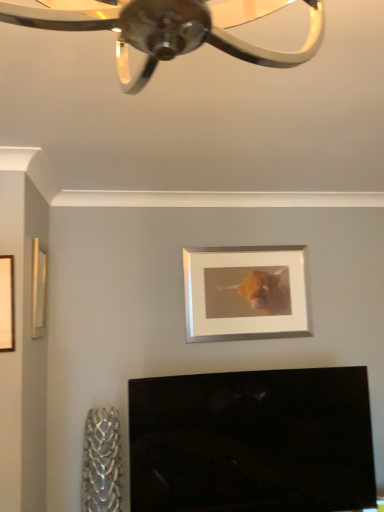
This screenshot has width=384, height=512. What do you see at coordinates (246, 293) in the screenshot?
I see `white matte picture frame at upper center, the first picture frame from the right` at bounding box center [246, 293].

You are a GUI agent. You are given a task and a screenshot of the screen. Output one action in this format:
    pyautogui.click(x=<x>, y=<y>)
    Task: Click on the wooden frame at left, arranged as the 3th picture frame when viewed from the right
    Image resolution: width=384 pixels, height=512 pixels.
    Given the screenshot: What is the action you would take?
    pyautogui.click(x=7, y=304)

What do you see at coordinates (38, 289) in the screenshot? I see `wooden frame at left, the 2th picture frame positioned from the front` at bounding box center [38, 289].

Locate an element on the screen. white matte picture frame at upper center, placed as the 3th picture frame when sorted from left to right is located at coordinates (246, 293).

In the image, there is a wooden frame at left, placed as the 3th picture frame when sorted from back to front. Identify the location of picture frame below it (from the image's perspective). This screenshot has height=512, width=384. (246, 293).

From a real-world perspective, who is located higher, white matte picture frame at upper center, which is the 1th picture frame from back to front, or wooden frame at left, arranged as the 3th picture frame when viewed from the right?

white matte picture frame at upper center, which is the 1th picture frame from back to front.

Is white matte picture frame at upper center, placed as the 3th picture frame when sorted from left to right, inside the boundaries of wooden frame at left, marked as the 1th picture frame in a front-to-back arrangement, or outside?

white matte picture frame at upper center, placed as the 3th picture frame when sorted from left to right, is not inside wooden frame at left, marked as the 1th picture frame in a front-to-back arrangement, it's outside.

Considering the sizes of objects white matte picture frame at upper center, the first picture frame from the right, and wooden frame at left, placed as the 3th picture frame when sorted from back to front, in the image provided, who is thinner, white matte picture frame at upper center, the first picture frame from the right, or wooden frame at left, placed as the 3th picture frame when sorted from back to front,?

Thinner between the two is wooden frame at left, placed as the 3th picture frame when sorted from back to front.

Does point (32, 319) lie in front of point (299, 298)?

Yes, it is in front of point (299, 298).

In the image, is wooden frame at left, which is the second picture frame from right to left, positioned in front of or behind white matte picture frame at upper center, acting as the 3th picture frame starting from the front?

Visually, wooden frame at left, which is the second picture frame from right to left, is located in front of white matte picture frame at upper center, acting as the 3th picture frame starting from the front.

Consider the image. Is there a large distance between wooden frame at left, the second picture frame viewed from the back, and white matte picture frame at upper center, placed as the 3th picture frame when sorted from left to right?

wooden frame at left, the second picture frame viewed from the back, is positioned a significant distance from white matte picture frame at upper center, placed as the 3th picture frame when sorted from left to right.

Considering the points (1, 283) and (211, 266), which point is in front, point (1, 283) or point (211, 266)?

The point (1, 283) is in front.

Relative to white matte picture frame at upper center, placed as the 3th picture frame when sorted from left to right, is wooden frame at left, placed as the 3th picture frame when sorted from back to front, in front or behind?

In the image, wooden frame at left, placed as the 3th picture frame when sorted from back to front, appears in front of white matte picture frame at upper center, placed as the 3th picture frame when sorted from left to right.

Which object is thinner, wooden frame at left, which is counted as the 1th picture frame, starting from the left, or white matte picture frame at upper center, the first picture frame from the right?

wooden frame at left, which is counted as the 1th picture frame, starting from the left, is thinner.

Between wooden frame at left, placed as the 3th picture frame when sorted from back to front, and white matte picture frame at upper center, the first picture frame from the right, which one appears on the left side from the viewer's perspective?

wooden frame at left, placed as the 3th picture frame when sorted from back to front, is more to the left.

From a real-world perspective, is wooden frame at left, which is counted as the 1th picture frame, starting from the left, located beneath wooden frame at left, the second picture frame viewed from the back?

Yes.

Is wooden frame at left, placed as the 3th picture frame when sorted from back to front, positioned with its back to wooden frame at left, acting as the 2th picture frame starting from the left?

Yes, wooden frame at left, placed as the 3th picture frame when sorted from back to front, is positioned with its back facing wooden frame at left, acting as the 2th picture frame starting from the left.

The width and height of the screenshot is (384, 512). What are the coordinates of `picture frame that is the 2nd one below the wooden frame at left, which is the second picture frame from right to left (from a real-world perspective)` in the screenshot? It's located at (7, 304).

Measure the distance between wooden frame at left, which is counted as the 1th picture frame, starting from the left, and wooden frame at left, the second picture frame viewed from the back.

They are 10.85 inches apart.

From the image's perspective, is white matte picture frame at upper center, the first picture frame from the right, under wooden frame at left, the 2th picture frame positioned from the front?

Indeed, from the image's perspective, white matte picture frame at upper center, the first picture frame from the right, is shown beneath wooden frame at left, the 2th picture frame positioned from the front.

Does white matte picture frame at upper center, which is the 1th picture frame from back to front, touch wooden frame at left, the 2th picture frame positioned from the front?

No, white matte picture frame at upper center, which is the 1th picture frame from back to front, is not in contact with wooden frame at left, the 2th picture frame positioned from the front.

Identify the location of picture frame behind the wooden frame at left, which is the second picture frame from right to left. (246, 293).

Considering the sizes of white matte picture frame at upper center, the first picture frame from the right, and wooden frame at left, the 2th picture frame positioned from the front, in the image, is white matte picture frame at upper center, the first picture frame from the right, taller or shorter than wooden frame at left, the 2th picture frame positioned from the front,?

In the image, white matte picture frame at upper center, the first picture frame from the right, appears to be taller than wooden frame at left, the 2th picture frame positioned from the front.

The image size is (384, 512). I want to click on picture frame lying on the left of wooden frame at left, the second picture frame viewed from the back, so click(7, 304).

From a real-world perspective, does wooden frame at left, the 2th picture frame positioned from the front, sit lower than wooden frame at left, arranged as the 3th picture frame when viewed from the right?

No, from a real-world perspective, wooden frame at left, the 2th picture frame positioned from the front, is not beneath wooden frame at left, arranged as the 3th picture frame when viewed from the right.

Which is in front, point (35, 285) or point (6, 266)?

Positioned in front is point (6, 266).

From the image's perspective, who appears lower, wooden frame at left, which is the second picture frame from right to left, or wooden frame at left, arranged as the 3th picture frame when viewed from the right?

From the image's view, wooden frame at left, arranged as the 3th picture frame when viewed from the right, is below.

In the image, there is a wooden frame at left, which is counted as the 1th picture frame, starting from the left. At what (x,y) coordinates should I click in order to perform the action: click on picture frame below it (from the image's perspective). Please return your answer as a coordinate pair (x, y). Looking at the image, I should click on (246, 293).

This screenshot has height=512, width=384. In order to click on picture frame located above the white matte picture frame at upper center, acting as the 3th picture frame starting from the front (from a real-world perspective) in this screenshot , I will do `click(38, 289)`.

Estimate the real-world distances between objects in this image. Which object is further from white matte picture frame at upper center, which is the 1th picture frame from back to front, wooden frame at left, which is counted as the 1th picture frame, starting from the left, or wooden frame at left, which is the second picture frame from right to left?

Based on the image, wooden frame at left, which is counted as the 1th picture frame, starting from the left, appears to be further to white matte picture frame at upper center, which is the 1th picture frame from back to front.

Consider the image. From the image, which object appears to be farther from wooden frame at left, acting as the 2th picture frame starting from the left, white matte picture frame at upper center, the first picture frame from the right, or wooden frame at left, which is counted as the 1th picture frame, starting from the left?

white matte picture frame at upper center, the first picture frame from the right, lies further to wooden frame at left, acting as the 2th picture frame starting from the left, than the other object.

When comparing their distances from wooden frame at left, the second picture frame viewed from the back, does wooden frame at left, arranged as the 3th picture frame when viewed from the right, or white matte picture frame at upper center, acting as the 3th picture frame starting from the front, seem closer?

wooden frame at left, arranged as the 3th picture frame when viewed from the right, is positioned closer to the anchor wooden frame at left, the second picture frame viewed from the back.

When comparing their distances from wooden frame at left, arranged as the 3th picture frame when viewed from the right, does wooden frame at left, the 2th picture frame positioned from the front, or white matte picture frame at upper center, which is the 1th picture frame from back to front, seem closer?

wooden frame at left, the 2th picture frame positioned from the front.

Looking at the image, which one is located closer to white matte picture frame at upper center, the first picture frame from the right, wooden frame at left, acting as the 2th picture frame starting from the left, or wooden frame at left, placed as the 3th picture frame when sorted from back to front?

The object closer to white matte picture frame at upper center, the first picture frame from the right, is wooden frame at left, acting as the 2th picture frame starting from the left.

Considering their positions, is white matte picture frame at upper center, placed as the 3th picture frame when sorted from left to right, positioned closer to wooden frame at left, which is counted as the 1th picture frame, starting from the left, than wooden frame at left, acting as the 2th picture frame starting from the left?

wooden frame at left, acting as the 2th picture frame starting from the left, is closer to wooden frame at left, which is counted as the 1th picture frame, starting from the left.

I want to click on picture frame between wooden frame at left, marked as the 1th picture frame in a front-to-back arrangement, and white matte picture frame at upper center, placed as the 3th picture frame when sorted from left to right, so (x=38, y=289).